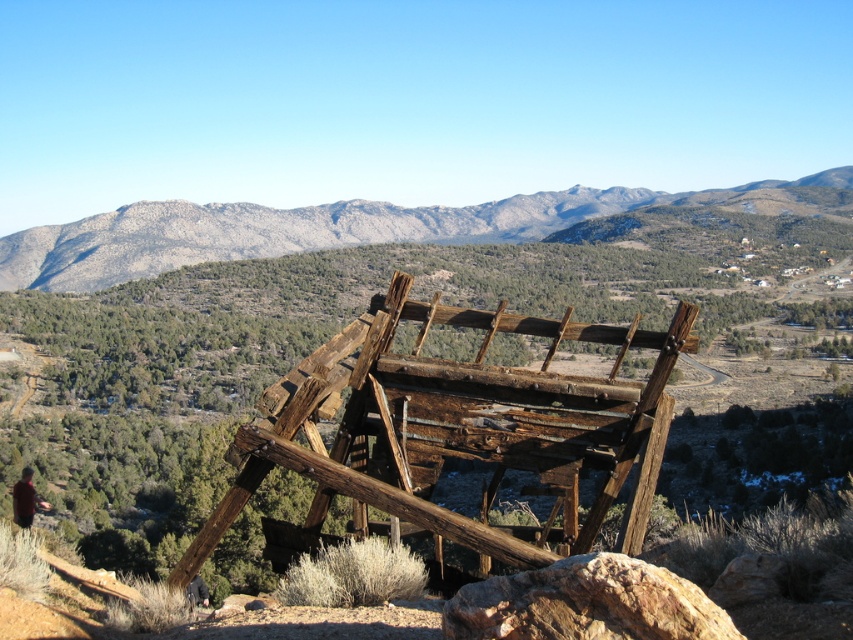
Between gray rocky mountain at center and rusty metal rock at lower right, which one appears on the left side from the viewer's perspective?

Positioned to the left is rusty metal rock at lower right.

Does gray rocky mountain at center appear on the right side of rusty metal rock at lower right?

Yes, gray rocky mountain at center is to the right of rusty metal rock at lower right.

Describe the element at coordinates (351, 227) in the screenshot. I see `gray rocky mountain at center` at that location.

The image size is (853, 640). I want to click on gray rocky mountain at center, so click(351, 227).

Who is more distant from viewer, (442,456) or (399,224)?

Point (399,224)

Does weathered wood structure at center appear on the right side of gray rocky mountain at center?

No, weathered wood structure at center is not to the right of gray rocky mountain at center.

Which is in front, point (608, 499) or point (778, 196)?

Positioned in front is point (608, 499).

Locate an element on the screen. weathered wood structure at center is located at coordinates (463, 429).

Is weathered wood structure at center smaller than rusty metal rock at lower right?

Actually, weathered wood structure at center might be larger than rusty metal rock at lower right.

Which of these two, weathered wood structure at center or rusty metal rock at lower right, stands shorter?

With less height is rusty metal rock at lower right.

Locate an element on the screen. The image size is (853, 640). weathered wood structure at center is located at coordinates (463, 429).